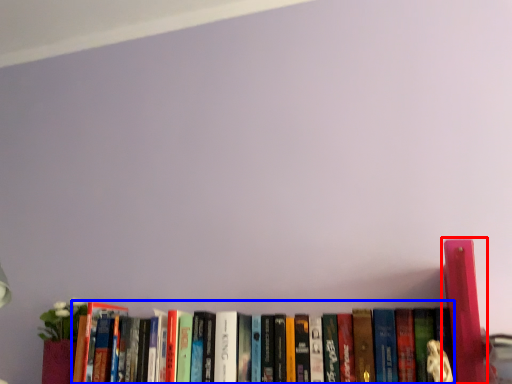
Question: Which object appears closest to the camera in this image, book (highlighted by a red box) or book (highlighted by a blue box)?

Choices:
 (A) book
 (B) book

Answer: (A)